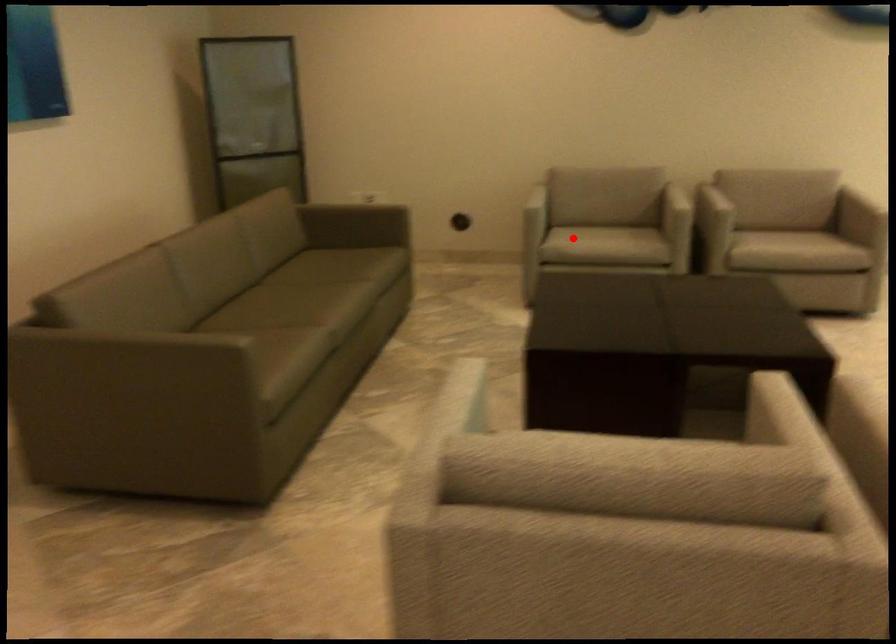
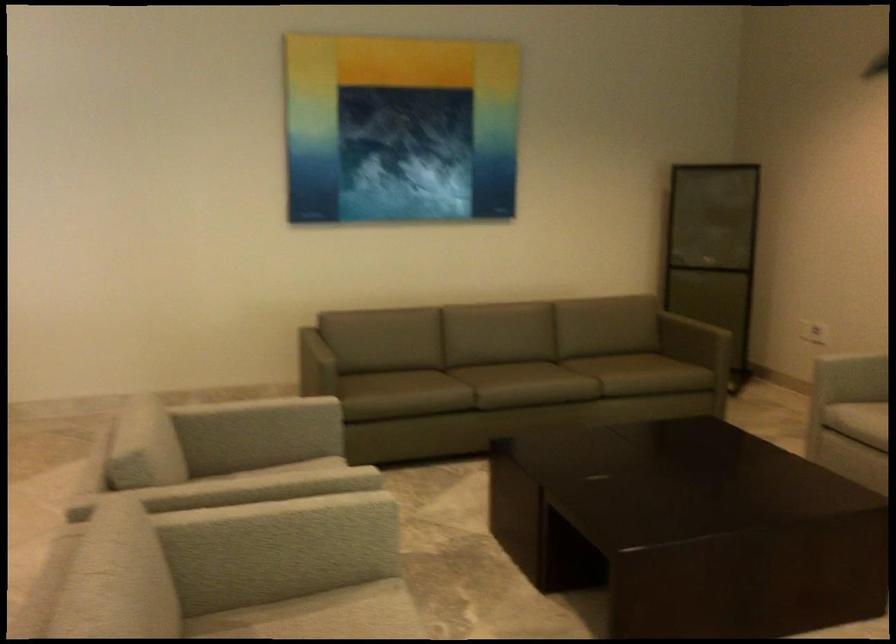
Find the pixel in the second image that matches the highlighted location in the first image.

(857, 420)